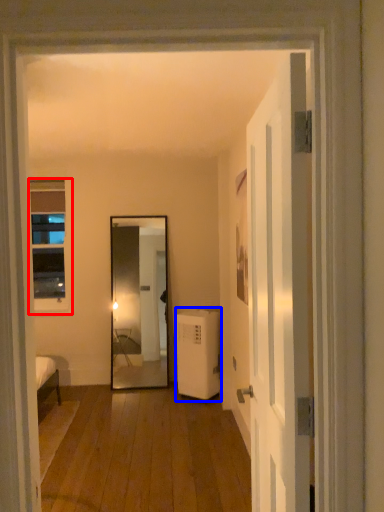
Question: Which object is further to the camera taking this photo, window (highlighted by a red box) or air conditioner (highlighted by a blue box)?

Choices:
 (A) window
 (B) air conditioner

Answer: (A)